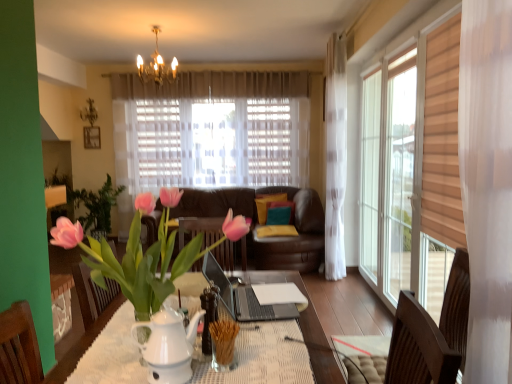
Question: Which direction should I rotate to face velvet yellow pillow at center, placed as the first pillow when sorted from back to front, — up or down?

Choices:
 (A) down
 (B) up

Answer: (A)

Question: Does wooden picture frame at upper left turn towards gold crystal chandelier at upper center?

Choices:
 (A) yes
 (B) no

Answer: (B)

Question: Is wooden picture frame at upper left not within gold crystal chandelier at upper center?

Choices:
 (A) no
 (B) yes

Answer: (B)

Question: Does wooden picture frame at upper left have a larger size compared to gold crystal chandelier at upper center?

Choices:
 (A) yes
 (B) no

Answer: (B)

Question: Is the position of wooden picture frame at upper left less distant than that of gold crystal chandelier at upper center?

Choices:
 (A) yes
 (B) no

Answer: (B)

Question: Is there a large distance between wooden picture frame at upper left and gold crystal chandelier at upper center?

Choices:
 (A) no
 (B) yes

Answer: (B)

Question: Considering the relative positions of wooden picture frame at upper left and gold crystal chandelier at upper center in the image provided, is wooden picture frame at upper left to the right of gold crystal chandelier at upper center from the viewer's perspective?

Choices:
 (A) no
 (B) yes

Answer: (A)

Question: From a real-world perspective, is velvet yellow pillow at center, the second pillow from the front, under gold crystal chandelier at upper center?

Choices:
 (A) yes
 (B) no

Answer: (A)

Question: Is velvet yellow pillow at center, the second pillow from the front, in front of gold crystal chandelier at upper center?

Choices:
 (A) yes
 (B) no

Answer: (B)

Question: Does velvet yellow pillow at center, the second pillow from the front, have a smaller size compared to gold crystal chandelier at upper center?

Choices:
 (A) yes
 (B) no

Answer: (A)

Question: Can you confirm if velvet yellow pillow at center, placed as the first pillow when sorted from back to front, is positioned to the left of gold crystal chandelier at upper center?

Choices:
 (A) yes
 (B) no

Answer: (B)

Question: From the image's perspective, would you say velvet yellow pillow at center, placed as the first pillow when sorted from back to front, is shown under gold crystal chandelier at upper center?

Choices:
 (A) no
 (B) yes

Answer: (B)

Question: Considering the relative sizes of velvet yellow pillow at center, placed as the first pillow when sorted from back to front, and gold crystal chandelier at upper center in the image provided, is velvet yellow pillow at center, placed as the first pillow when sorted from back to front, thinner than gold crystal chandelier at upper center?

Choices:
 (A) no
 (B) yes

Answer: (B)

Question: From the image's perspective, does velvet teal pillow at center, arranged as the 1th pillow when viewed from the front, appear higher than pink glossy tulip at center?

Choices:
 (A) yes
 (B) no

Answer: (B)